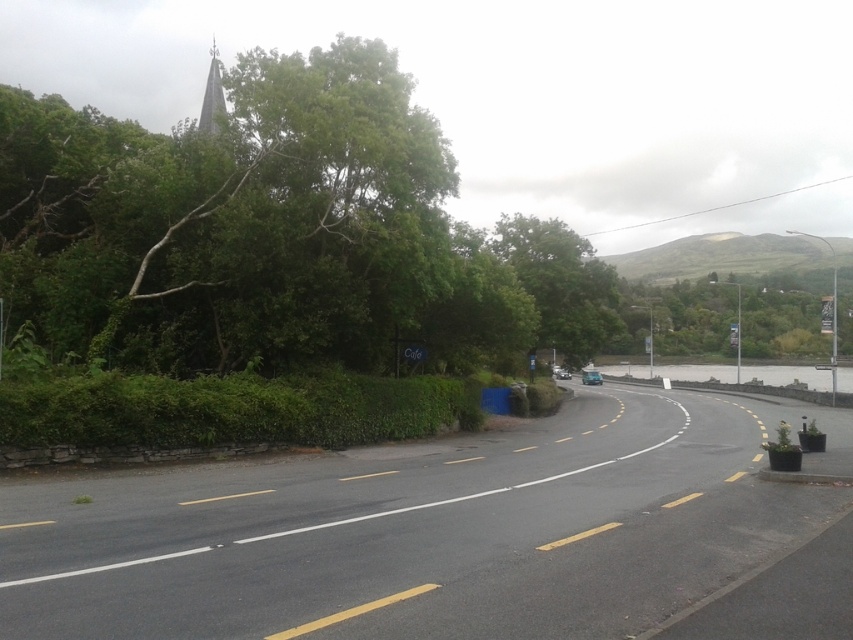
Question: Is green leafy tree at upper left positioned behind green leafy hedge at lower left?

Choices:
 (A) no
 (B) yes

Answer: (B)

Question: Is green leafy tree at upper left above green leafy hedge at lower left?

Choices:
 (A) no
 (B) yes

Answer: (B)

Question: Which point is closer to the camera?

Choices:
 (A) green leafy tree at upper left
 (B) green leafy hedge at lower left

Answer: (B)

Question: Among these points, which one is nearest to the camera?

Choices:
 (A) (126, 400)
 (B) (579, 298)

Answer: (A)

Question: Where is green leafy tree at upper left located in relation to green leafy hedge at lower left in the image?

Choices:
 (A) right
 (B) left

Answer: (B)